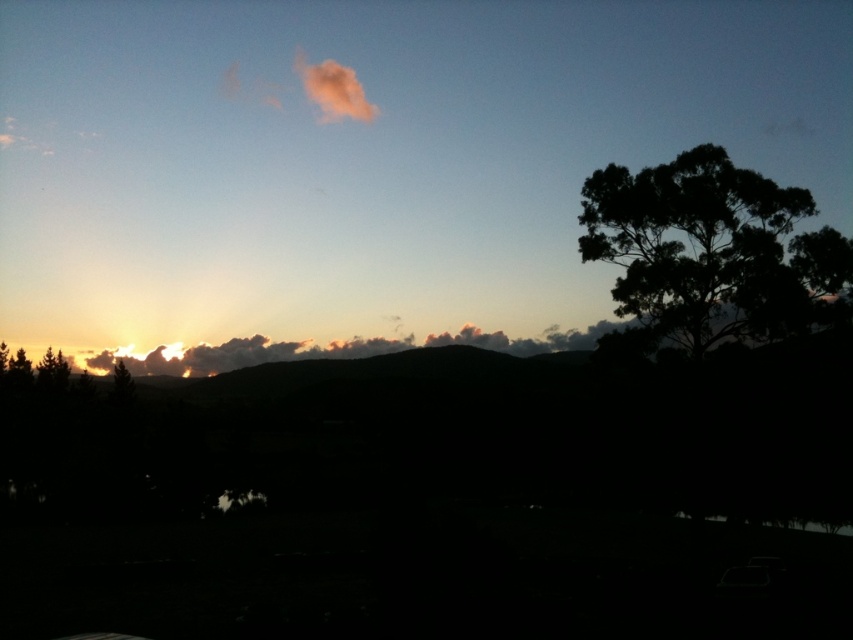
Question: Is dark green leafy tree at right positioned at the back of fuzzy pink cloud at upper center?

Choices:
 (A) no
 (B) yes

Answer: (A)

Question: Considering the relative positions of dark green leafy tree at right and fuzzy pink cloud at upper center in the image provided, where is dark green leafy tree at right located with respect to fuzzy pink cloud at upper center?

Choices:
 (A) right
 (B) left

Answer: (A)

Question: Can you confirm if dark green leafy tree at right is positioned to the left of fuzzy pink cloud at upper center?

Choices:
 (A) no
 (B) yes

Answer: (A)

Question: Which point is closer to the camera?

Choices:
 (A) (323, 100)
 (B) (703, 214)

Answer: (B)